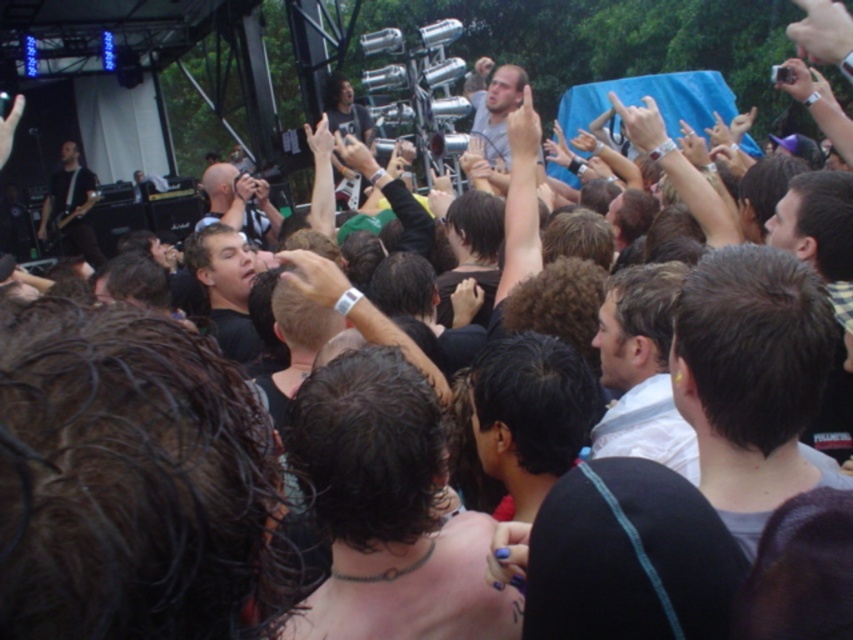
Question: Observing the image, what is the correct spatial positioning of dark brown hair at center in reference to white striped shirt at center?

Choices:
 (A) right
 (B) left

Answer: (B)

Question: Does dark brown hair at center have a lesser width compared to white striped shirt at center?

Choices:
 (A) yes
 (B) no

Answer: (B)

Question: Can you confirm if dark brown hair at center is wider than white striped shirt at center?

Choices:
 (A) yes
 (B) no

Answer: (A)

Question: Estimate the real-world distances between objects in this image. Which object is closer to the black shirt at center?

Choices:
 (A) short brown hair at center
 (B) black leather guitar at left
 (C) dark brown hair at center
 (D) white striped shirt at center

Answer: (D)

Question: Which of the following is the farthest from the observer?

Choices:
 (A) short brown hair at center
 (B) white striped shirt at center
 (C) dark brown hair at center

Answer: (B)

Question: Which point is farther to the camera?

Choices:
 (A) white striped shirt at center
 (B) dark brown hair at center

Answer: (A)